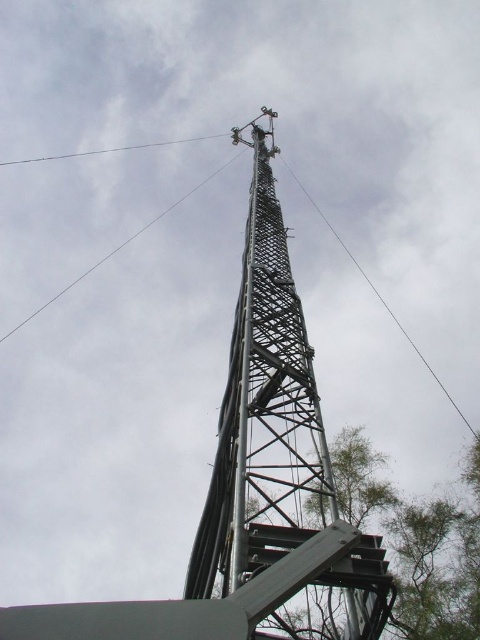
Does green leafy tree at bottom right have a greater width compared to metallic wire at upper center?

No.

Does green leafy tree at bottom right appear on the right side of metallic wire at upper center?

Yes, green leafy tree at bottom right is to the right of metallic wire at upper center.

Is point (475, 566) farther from viewer compared to point (98, 260)?

No, (475, 566) is closer to viewer.

Where is `green leafy tree at bottom right`? This screenshot has height=640, width=480. green leafy tree at bottom right is located at coordinates (419, 541).

Who is lower down, metallic lattice tower at center or smooth wire at upper center?

metallic lattice tower at center is lower down.

Does metallic lattice tower at center appear on the right side of smooth wire at upper center?

Yes, metallic lattice tower at center is to the right of smooth wire at upper center.

Describe the element at coordinates (263, 404) in the screenshot. This screenshot has width=480, height=640. I see `metallic lattice tower at center` at that location.

Where is `metallic lattice tower at center`? The width and height of the screenshot is (480, 640). metallic lattice tower at center is located at coordinates (263, 404).

From the picture: Which is above, metallic grid tower at upper center or smooth wire at upper center?

smooth wire at upper center

Which is more to the right, metallic grid tower at upper center or smooth wire at upper center?

metallic grid tower at upper center

Who is more distant from viewer, (291, 170) or (98, 150)?

Positioned behind is point (98, 150).

Where is `metallic grid tower at upper center`? This screenshot has height=640, width=480. metallic grid tower at upper center is located at coordinates (383, 301).